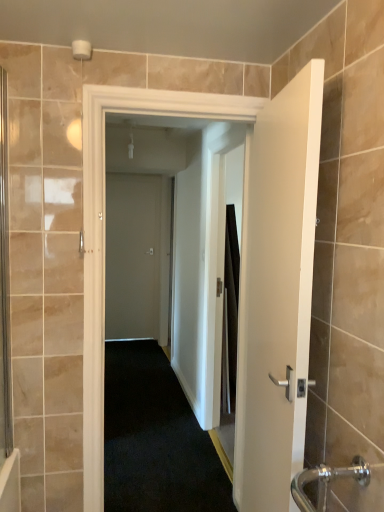
Based on the photo, measure the distance between white matte door at center, the third door from the back, and camera.

They are 1.16 meters apart.

Identify the location of white matte door at center, which is the second door in left-to-right order. The height and width of the screenshot is (512, 384). (252, 280).

This screenshot has height=512, width=384. What do you see at coordinates (229, 334) in the screenshot?
I see `transparent glass screen door at center, which is counted as the second screen door, starting from the left` at bounding box center [229, 334].

Locate an element on the screen. white matte door at center, the first door from the right is located at coordinates (277, 293).

From a real-world perspective, is clear glass screen door at left, acting as the first screen door starting from the left, under white matte door at center, which is the second door in left-to-right order?

Incorrect, from a real-world perspective, clear glass screen door at left, acting as the first screen door starting from the left, is higher than white matte door at center, which is the second door in left-to-right order.

Is clear glass screen door at left, acting as the first screen door starting from the left, positioned with its back to white matte door at center, which is the second door from back to front?

clear glass screen door at left, acting as the first screen door starting from the left, is not turned away from white matte door at center, which is the second door from back to front.

Is clear glass screen door at left, acting as the first screen door starting from the left, not near white matte door at center, which is counted as the second door, starting from the right?

Yes.

From the image's perspective, is clear glass screen door at left, the second screen door from the back, above or below white matte door at center, which is the second door from back to front?

Based on their image positions, clear glass screen door at left, the second screen door from the back, is located above white matte door at center, which is the second door from back to front.

From the image's perspective, would you say matte gray door at center, which is the 1th door in left-to-right order, is shown under clear glass screen door at left, the second screen door from the back?

Yes.

Is matte gray door at center, the 3th door positioned from the right, spatially inside clear glass screen door at left, placed as the 2th screen door when sorted from right to left, or outside of it?

matte gray door at center, the 3th door positioned from the right, is outside clear glass screen door at left, placed as the 2th screen door when sorted from right to left.

Identify the location of the 2nd screen door in front of the matte gray door at center, which is the 1th door in left-to-right order, starting your count from the anchor. point(4,282).

Can you confirm if matte gray door at center, the 3th door positioned from the right, is thinner than clear glass screen door at left, placed as the 2th screen door when sorted from right to left?

Incorrect, the width of matte gray door at center, the 3th door positioned from the right, is not less than that of clear glass screen door at left, placed as the 2th screen door when sorted from right to left.

Is white matte door at center, the 3th door viewed from the left, spatially inside matte gray door at center, which is the first door in back-to-front order, or outside of it?

white matte door at center, the 3th door viewed from the left, is located beyond the bounds of matte gray door at center, which is the first door in back-to-front order.

Is there a large distance between white matte door at center, arranged as the 1th door when viewed from the front, and matte gray door at center, which is the 1th door in left-to-right order?

Indeed, white matte door at center, arranged as the 1th door when viewed from the front, is not near matte gray door at center, which is the 1th door in left-to-right order.

Does white matte door at center, arranged as the 1th door when viewed from the front, have a smaller size compared to matte gray door at center, the 3th door from the front?

No, white matte door at center, arranged as the 1th door when viewed from the front, is not smaller than matte gray door at center, the 3th door from the front.

Can you confirm if white matte door at center, which appears as the 2th door when viewed from the front, is shorter than clear glass screen door at left, the first screen door viewed from the front?

No, white matte door at center, which appears as the 2th door when viewed from the front, is not shorter than clear glass screen door at left, the first screen door viewed from the front.

Is white matte door at center, which is the second door in left-to-right order, wider than clear glass screen door at left, acting as the first screen door starting from the left?

Yes.

Considering the points (269, 387) and (7, 294), which point is behind, point (269, 387) or point (7, 294)?

Positioned behind is point (7, 294).

Considering the relative sizes of white matte door at center, which is the second door in left-to-right order, and clear glass screen door at left, the first screen door viewed from the front, in the image provided, is white matte door at center, which is the second door in left-to-right order, smaller than clear glass screen door at left, the first screen door viewed from the front,?

No, white matte door at center, which is the second door in left-to-right order, is not smaller than clear glass screen door at left, the first screen door viewed from the front.

Considering the sizes of objects clear glass screen door at left, placed as the 2th screen door when sorted from right to left, and transparent glass screen door at center, placed as the 1th screen door when sorted from right to left, in the image provided, who is shorter, clear glass screen door at left, placed as the 2th screen door when sorted from right to left, or transparent glass screen door at center, placed as the 1th screen door when sorted from right to left,?

transparent glass screen door at center, placed as the 1th screen door when sorted from right to left.

Considering the sizes of objects clear glass screen door at left, the second screen door from the back, and transparent glass screen door at center, which appears as the second screen door when viewed from the front, in the image provided, who is wider, clear glass screen door at left, the second screen door from the back, or transparent glass screen door at center, which appears as the second screen door when viewed from the front,?

With larger width is transparent glass screen door at center, which appears as the second screen door when viewed from the front.

From the image's perspective, is clear glass screen door at left, acting as the first screen door starting from the left, located beneath transparent glass screen door at center, which appears as the second screen door when viewed from the front?

No, from the image's perspective, clear glass screen door at left, acting as the first screen door starting from the left, is not below transparent glass screen door at center, which appears as the second screen door when viewed from the front.

Where is `screen door that is above the transparent glass screen door at center, which appears as the second screen door when viewed from the front (from a real-world perspective)`? The width and height of the screenshot is (384, 512). screen door that is above the transparent glass screen door at center, which appears as the second screen door when viewed from the front (from a real-world perspective) is located at coordinates (4, 282).

Which object is further away from the camera taking this photo, white matte door at center, which is the second door in left-to-right order, or white matte door at center, arranged as the 1th door when viewed from the front?

Positioned behind is white matte door at center, which is the second door in left-to-right order.

Who is smaller, white matte door at center, which is counted as the second door, starting from the right, or white matte door at center, the 3th door viewed from the left?

Smaller between the two is white matte door at center, which is counted as the second door, starting from the right.

Is white matte door at center, which is counted as the second door, starting from the right, at the left side of white matte door at center, the first door from the right?

Yes.

Based on the photo, between white matte door at center, which is the second door from back to front, and matte gray door at center, the 3th door from the front, which one appears on the left side from the viewer's perspective?

Positioned to the left is matte gray door at center, the 3th door from the front.

Can you confirm if white matte door at center, which appears as the 2th door when viewed from the front, is wider than matte gray door at center, the 3th door from the front?

Yes.

Can you confirm if white matte door at center, which is counted as the second door, starting from the right, is bigger than matte gray door at center, which is the first door in back-to-front order?

Yes, white matte door at center, which is counted as the second door, starting from the right, is bigger than matte gray door at center, which is the first door in back-to-front order.

From a real-world perspective, is white matte door at center, which is counted as the second door, starting from the right, physically below matte gray door at center, which is the first door in back-to-front order?

Actually, white matte door at center, which is counted as the second door, starting from the right, is physically above matte gray door at center, which is the first door in back-to-front order, in the real world.

Where is `screen door that is above the white matte door at center, which is the second door from back to front (from a real-world perspective)`? screen door that is above the white matte door at center, which is the second door from back to front (from a real-world perspective) is located at coordinates (4, 282).

The image size is (384, 512). I want to click on door that is the 1st one when counting downward from the clear glass screen door at left, the first screen door viewed from the front (from the image's perspective), so (132, 256).

From the image, which object appears to be farther from white matte door at center, which is counted as the second door, starting from the right, clear glass screen door at left, placed as the 2th screen door when sorted from right to left, or matte gray door at center, the 3th door from the front?

clear glass screen door at left, placed as the 2th screen door when sorted from right to left, lies further to white matte door at center, which is counted as the second door, starting from the right, than the other object.

From the image, which object appears to be nearer to white matte door at center, arranged as the 1th door when viewed from the front, matte gray door at center, which is the first door in back-to-front order, or clear glass screen door at left, the second screen door from the back?

clear glass screen door at left, the second screen door from the back.

Based on their spatial positions, is transparent glass screen door at center, placed as the 1th screen door when sorted from right to left, or white matte door at center, the first door from the right, further from white matte door at center, which is the second door in left-to-right order?

white matte door at center, the first door from the right.

When comparing their distances from clear glass screen door at left, placed as the 2th screen door when sorted from right to left, does transparent glass screen door at center, which appears as the second screen door when viewed from the front, or matte gray door at center, which is the first door in back-to-front order, seem further?

Based on the image, matte gray door at center, which is the first door in back-to-front order, appears to be further to clear glass screen door at left, placed as the 2th screen door when sorted from right to left.

Looking at the image, which one is located closer to white matte door at center, the 3th door viewed from the left, transparent glass screen door at center, which appears as the second screen door when viewed from the front, or clear glass screen door at left, acting as the first screen door starting from the left?

Based on the image, clear glass screen door at left, acting as the first screen door starting from the left, appears to be nearer to white matte door at center, the 3th door viewed from the left.

Which object lies further to the anchor point matte gray door at center, the 3th door positioned from the right, white matte door at center, arranged as the 1th door when viewed from the front, or transparent glass screen door at center, placed as the 1th screen door when sorted from right to left?

Among the two, white matte door at center, arranged as the 1th door when viewed from the front, is located further to matte gray door at center, the 3th door positioned from the right.

Which object lies nearer to the anchor point clear glass screen door at left, the second screen door from the back, white matte door at center, arranged as the 1th door when viewed from the front, or transparent glass screen door at center, which is the 1th screen door from back to front?

Among the two, white matte door at center, arranged as the 1th door when viewed from the front, is located nearer to clear glass screen door at left, the second screen door from the back.

Estimate the real-world distances between objects in this image. Which object is further from white matte door at center, which appears as the 2th door when viewed from the front, white matte door at center, the third door from the back, or clear glass screen door at left, acting as the first screen door starting from the left?

clear glass screen door at left, acting as the first screen door starting from the left, lies further to white matte door at center, which appears as the 2th door when viewed from the front, than the other object.

You are a GUI agent. You are given a task and a screenshot of the screen. Output one action in this format:
    pyautogui.click(x=<x>, y=<y>)
    Task: Click on the screen door between white matte door at center, the 3th door viewed from the left, and transparent glass screen door at center, which is counted as the second screen door, starting from the left, along the z-axis
    
    Given the screenshot: What is the action you would take?
    pyautogui.click(x=4, y=282)

The height and width of the screenshot is (512, 384). I want to click on door between clear glass screen door at left, the first screen door viewed from the front, and matte gray door at center, which is the 1th door in left-to-right order, from front to back, so click(252, 280).

Identify the location of door between white matte door at center, the first door from the right, and matte gray door at center, the 3th door positioned from the right, along the z-axis. (252, 280).

Image resolution: width=384 pixels, height=512 pixels. I want to click on door between clear glass screen door at left, the second screen door from the back, and transparent glass screen door at center, which is the 1th screen door from back to front, in the front-back direction, so (x=252, y=280).